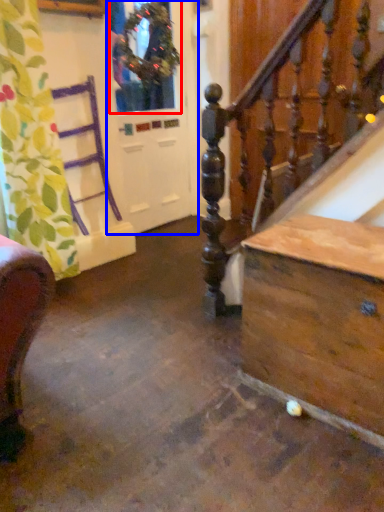
Question: Among these objects, which one is farthest to the camera, window (highlighted by a red box) or screen door (highlighted by a blue box)?

Choices:
 (A) window
 (B) screen door

Answer: (B)